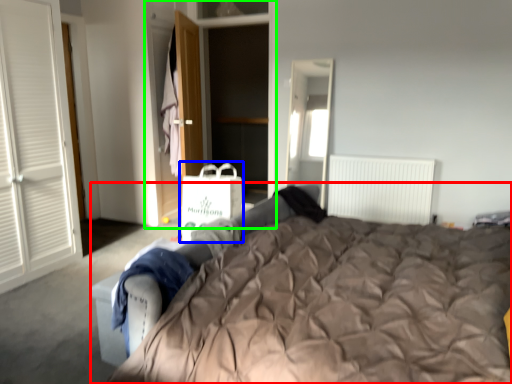
Question: Which object is the closest to the bed (highlighted by a red box)? Choose among these: shopping bag (highlighted by a blue box) or armoire (highlighted by a green box).

Choices:
 (A) shopping bag
 (B) armoire

Answer: (A)